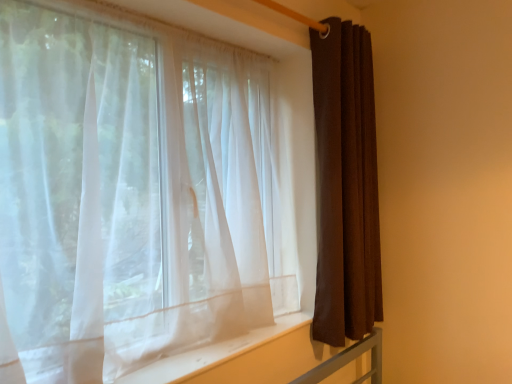
Question: Is white sheer fabric at lower center completely or partially inside brown fabric curtain at right, which is the 2th curtain from left to right?

Choices:
 (A) yes
 (B) no

Answer: (B)

Question: Is brown fabric curtain at right, which is the 2th curtain from left to right, shorter than white sheer fabric at lower center?

Choices:
 (A) no
 (B) yes

Answer: (A)

Question: Is brown fabric curtain at right, which is the 2th curtain from left to right, positioned with its back to white sheer fabric at lower center?

Choices:
 (A) yes
 (B) no

Answer: (B)

Question: Is brown fabric curtain at right, which is the 2th curtain from left to right, positioned beyond the bounds of white sheer fabric at lower center?

Choices:
 (A) no
 (B) yes

Answer: (B)

Question: From a real-world perspective, is brown fabric curtain at right, marked as the 1th curtain in a right-to-left arrangement, on top of white sheer fabric at lower center?

Choices:
 (A) no
 (B) yes

Answer: (B)

Question: Considering the positions of sheer white curtain at left, which is counted as the 1th curtain, starting from the left, and brown fabric curtain at right, which is the 2th curtain from left to right, in the image, is sheer white curtain at left, which is counted as the 1th curtain, starting from the left, taller or shorter than brown fabric curtain at right, which is the 2th curtain from left to right,?

Choices:
 (A) tall
 (B) short

Answer: (B)

Question: From the image's perspective, relative to brown fabric curtain at right, marked as the 1th curtain in a right-to-left arrangement, is sheer white curtain at left, which ranks as the second curtain in right-to-left order, above or below?

Choices:
 (A) above
 (B) below

Answer: (B)

Question: In terms of size, does sheer white curtain at left, which is counted as the 1th curtain, starting from the left, appear bigger or smaller than brown fabric curtain at right, marked as the 1th curtain in a right-to-left arrangement?

Choices:
 (A) small
 (B) big

Answer: (B)

Question: Is sheer white curtain at left, which is counted as the 1th curtain, starting from the left, spatially inside brown fabric curtain at right, marked as the 1th curtain in a right-to-left arrangement, or outside of it?

Choices:
 (A) inside
 (B) outside

Answer: (B)

Question: Considering their positions, is sheer white curtain at left, which ranks as the second curtain in right-to-left order, located in front of or behind white sheer fabric at lower center?

Choices:
 (A) front
 (B) behind

Answer: (A)

Question: Would you say sheer white curtain at left, which is counted as the 1th curtain, starting from the left, is to the left or to the right of white sheer fabric at lower center in the picture?

Choices:
 (A) left
 (B) right

Answer: (A)

Question: From a real-world perspective, is sheer white curtain at left, which ranks as the second curtain in right-to-left order, above or below white sheer fabric at lower center?

Choices:
 (A) below
 (B) above

Answer: (B)

Question: Looking at their shapes, would you say sheer white curtain at left, which ranks as the second curtain in right-to-left order, is wider or thinner than white sheer fabric at lower center?

Choices:
 (A) thin
 (B) wide

Answer: (A)

Question: From the image's perspective, relative to sheer white curtain at left, which ranks as the second curtain in right-to-left order, is brown fabric curtain at right, which is the 2th curtain from left to right, above or below?

Choices:
 (A) above
 (B) below

Answer: (A)

Question: Is brown fabric curtain at right, which is the 2th curtain from left to right, in front of or behind sheer white curtain at left, which ranks as the second curtain in right-to-left order, in the image?

Choices:
 (A) behind
 (B) front

Answer: (A)